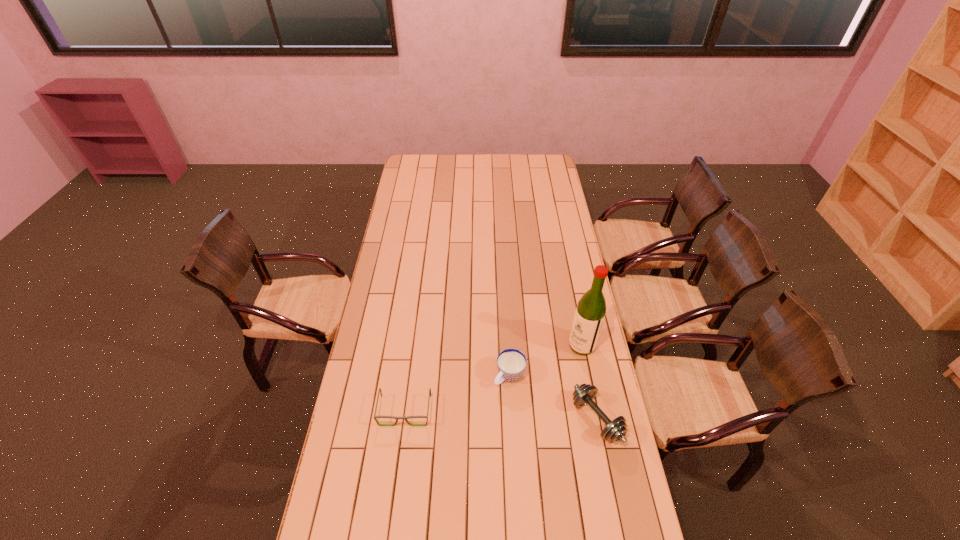
Where is `vacant space at the left edge of the desktop`? The image size is (960, 540). vacant space at the left edge of the desktop is located at coordinates (358, 423).

In the image, there is a desktop. Where is `vacant space at the right edge`? vacant space at the right edge is located at coordinates (557, 217).

In order to click on vacant area that lies between the third nearest object and the dumbbell in this screenshot , I will do 553,397.

You are a GUI agent. You are given a task and a screenshot of the screen. Output one action in this format:
    pyautogui.click(x=<x>, y=<y>)
    Task: Click on the vacant area that lies between the leftmost object and the second shortest object
    The image size is (960, 540).
    Given the screenshot: What is the action you would take?
    pyautogui.click(x=457, y=393)

You are a GUI agent. You are given a task and a screenshot of the screen. Output one action in this format:
    pyautogui.click(x=<x>, y=<y>)
    Task: Click on the free space between the dumbbell and the farthest object
    
    Given the screenshot: What is the action you would take?
    pyautogui.click(x=589, y=382)

Identify the location of free space that is in between the dumbbell and the third object from right to left. The width and height of the screenshot is (960, 540). (553, 397).

Identify the location of free area in between the liquor and the shortest object. This screenshot has height=540, width=960. (493, 378).

I want to click on vacant region between the cup and the dumbbell, so click(553, 397).

Locate an element on the screen. The height and width of the screenshot is (540, 960). free spot between the dumbbell and the third object from right to left is located at coordinates (553, 397).

The image size is (960, 540). I want to click on vacant region between the farthest object and the dumbbell, so click(589, 382).